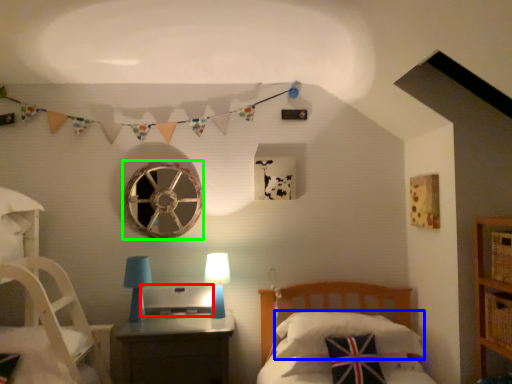
Question: Which object is positioned farthest from desktop (highlighted by a red box)? Select from pillow (highlighted by a blue box) and oval (highlighted by a green box).

Choices:
 (A) pillow
 (B) oval

Answer: (A)